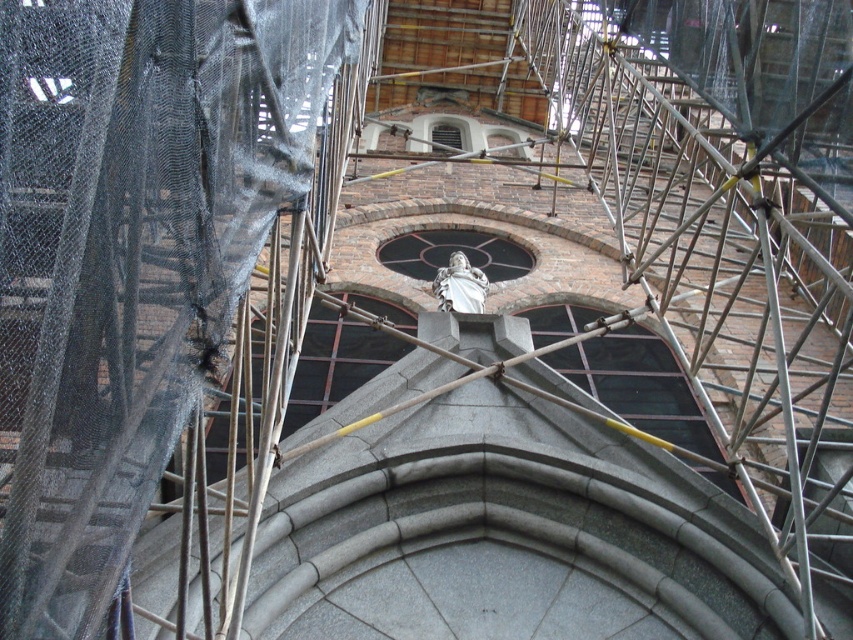
Question: Which point is closer to the camera?

Choices:
 (A) metal scaffolding at center
 (B) white marble statue at center

Answer: (A)

Question: Can you confirm if metal scaffolding at center is positioned above white marble statue at center?

Choices:
 (A) yes
 (B) no

Answer: (A)

Question: Is metal scaffolding at center positioned before white marble statue at center?

Choices:
 (A) no
 (B) yes

Answer: (B)

Question: Can you confirm if metal scaffolding at center is positioned to the left of white marble statue at center?

Choices:
 (A) no
 (B) yes

Answer: (B)